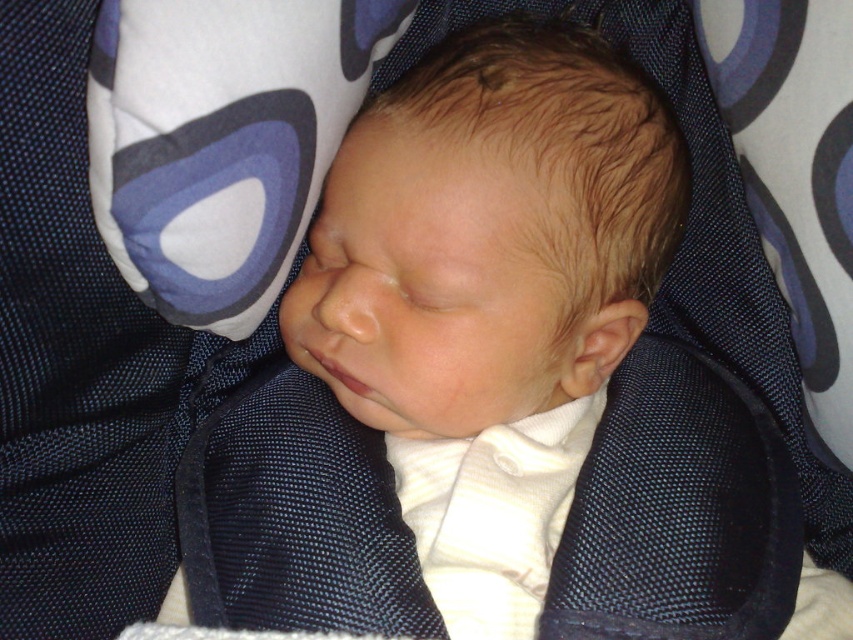
Consider the image. Is smooth white baby at center positioned at the back of white fabric pillow at upper center?

Yes, it is behind white fabric pillow at upper center.

Who is more distant from viewer, (389, 362) or (259, 241)?

Positioned behind is point (389, 362).

I want to click on smooth white baby at center, so click(488, 285).